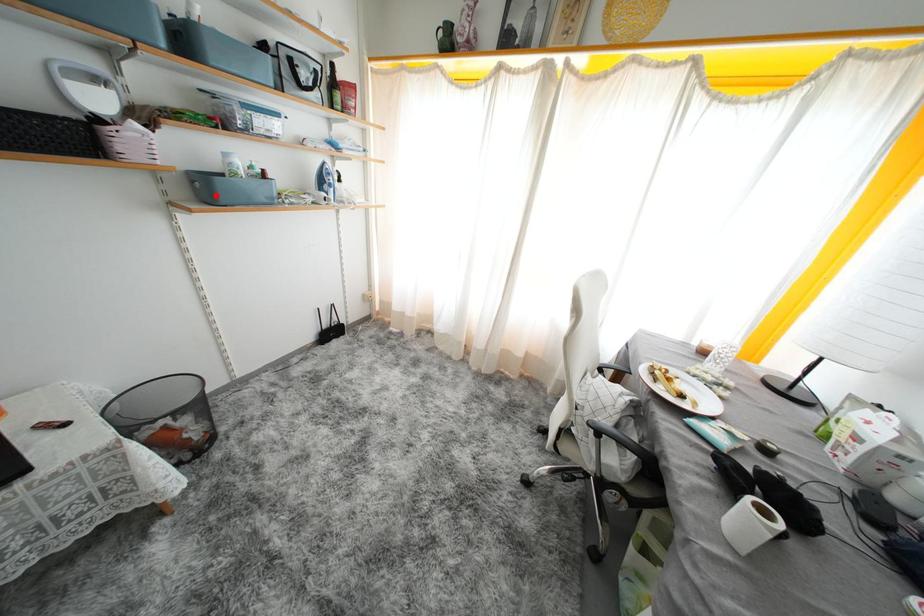
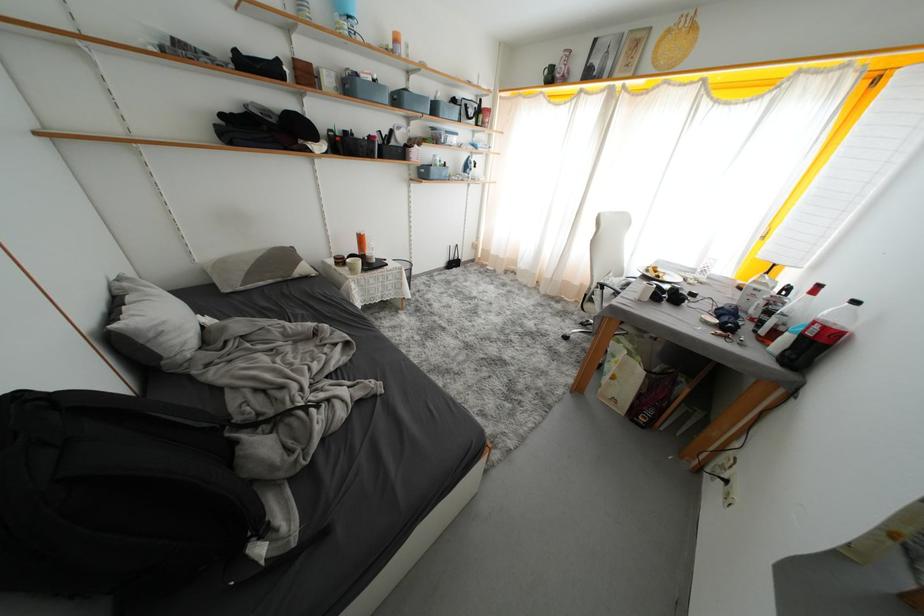
Locate, in the second image, the point that corresponds to the highlighted location in the first image.

(431, 177)